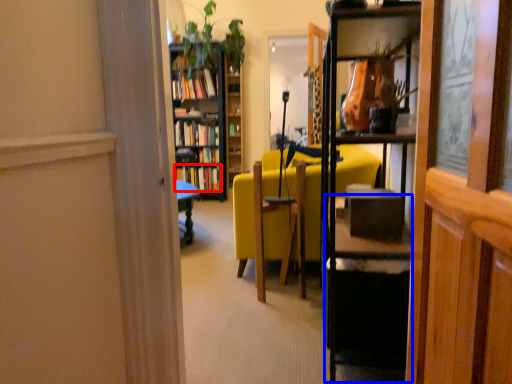
Question: Which point is closer to the camera, book (highlighted by a red box) or table (highlighted by a blue box)?

Choices:
 (A) book
 (B) table

Answer: (B)